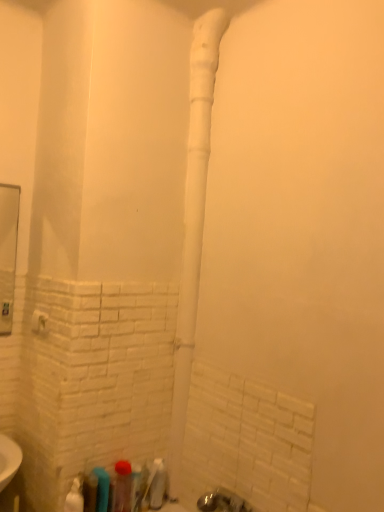
Question: Is white plastic pipe at center not close to translucent plastic bottle at lower left, the 4th toiletry when ordered from right to left?

Choices:
 (A) yes
 (B) no

Answer: (B)

Question: From a real-world perspective, is white plastic pipe at center physically below translucent plastic bottle at lower left, the 4th toiletry when ordered from right to left?

Choices:
 (A) yes
 (B) no

Answer: (B)

Question: Is white plastic pipe at center looking in the opposite direction of translucent plastic bottle at lower left, the 4th toiletry when ordered from right to left?

Choices:
 (A) no
 (B) yes

Answer: (A)

Question: From the image's perspective, is white plastic pipe at center beneath translucent plastic bottle at lower left, the 4th toiletry when ordered from right to left?

Choices:
 (A) no
 (B) yes

Answer: (A)

Question: Considering the relative sizes of white plastic pipe at center and translucent plastic bottle at lower left, which is the third toiletry in left-to-right order, in the image provided, is white plastic pipe at center shorter than translucent plastic bottle at lower left, which is the third toiletry in left-to-right order,?

Choices:
 (A) no
 (B) yes

Answer: (A)

Question: Considering the positions of translucent plastic bottle at lower center, which ranks as the sixth toiletry in left-to-right order, and translucent plastic bottle at lower left, the 4th toiletry when ordered from right to left, in the image, is translucent plastic bottle at lower center, which ranks as the sixth toiletry in left-to-right order, wider or thinner than translucent plastic bottle at lower left, the 4th toiletry when ordered from right to left,?

Choices:
 (A) wide
 (B) thin

Answer: (B)

Question: Is translucent plastic bottle at lower center, positioned as the 1th toiletry in right-to-left order, to the left or to the right of translucent plastic bottle at lower left, which is the third toiletry in left-to-right order, in the image?

Choices:
 (A) right
 (B) left

Answer: (A)

Question: Is point (152, 501) positioned closer to the camera than point (100, 488)?

Choices:
 (A) closer
 (B) farther

Answer: (B)

Question: From the image's perspective, is translucent plastic bottle at lower center, positioned as the 1th toiletry in right-to-left order, located above or below translucent plastic bottle at lower left, which is the third toiletry in left-to-right order?

Choices:
 (A) above
 (B) below

Answer: (B)

Question: Is white plastic pipe at center wider or thinner than translucent plastic bottle at lower left, which is the fifth toiletry from right to left?

Choices:
 (A) thin
 (B) wide

Answer: (B)

Question: In terms of height, does white plastic pipe at center look taller or shorter compared to translucent plastic bottle at lower left, which is the fifth toiletry from right to left?

Choices:
 (A) short
 (B) tall

Answer: (B)

Question: In terms of size, does white plastic pipe at center appear bigger or smaller than translucent plastic bottle at lower left, which is counted as the second toiletry, starting from the left?

Choices:
 (A) small
 (B) big

Answer: (B)

Question: In the image, is white plastic pipe at center on the left side or the right side of translucent plastic bottle at lower left, which is counted as the second toiletry, starting from the left?

Choices:
 (A) right
 (B) left

Answer: (A)

Question: Considering their positions, is white plastic towel bar at lower left located in front of or behind white glossy spray bottle at lower left, which is counted as the sixth toiletry, starting from the right?

Choices:
 (A) front
 (B) behind

Answer: (B)

Question: Considering the positions of white plastic towel bar at lower left and white glossy spray bottle at lower left, the 1th toiletry positioned from the left, in the image, is white plastic towel bar at lower left bigger or smaller than white glossy spray bottle at lower left, the 1th toiletry positioned from the left,?

Choices:
 (A) big
 (B) small

Answer: (B)